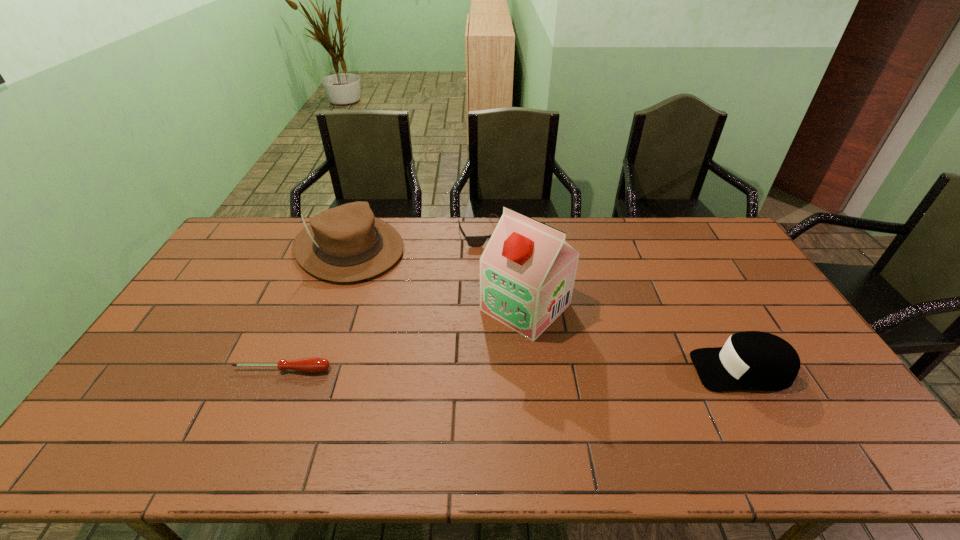
Identify the location of object that can be found as the closest to the second shortest object. The height and width of the screenshot is (540, 960). (527, 271).

Where is `object that is the second nearest to the rightmost object`? object that is the second nearest to the rightmost object is located at coordinates (473, 241).